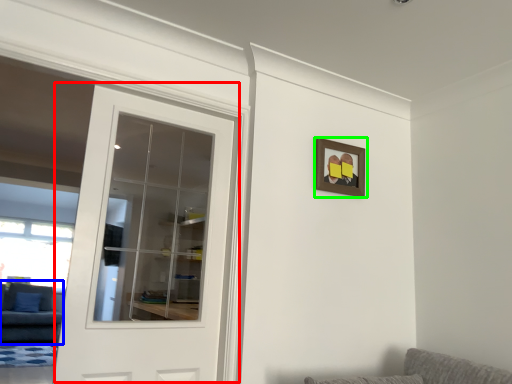
Question: Considering the real-world distances, which object is farthest from door (highlighted by a red box)? couch (highlighted by a blue box) or picture frame (highlighted by a green box)?

Choices:
 (A) couch
 (B) picture frame

Answer: (B)